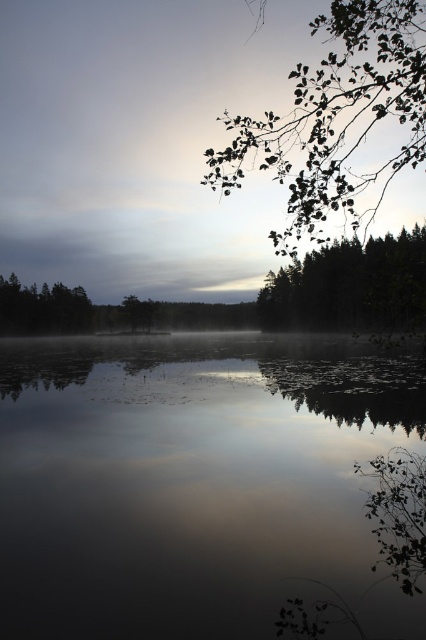
You are standing at the edge of the lake and notice a point marked at coordinates (141, 141). What is located at that point?

The point at coordinates (141, 141) indicates transparent mist at center.